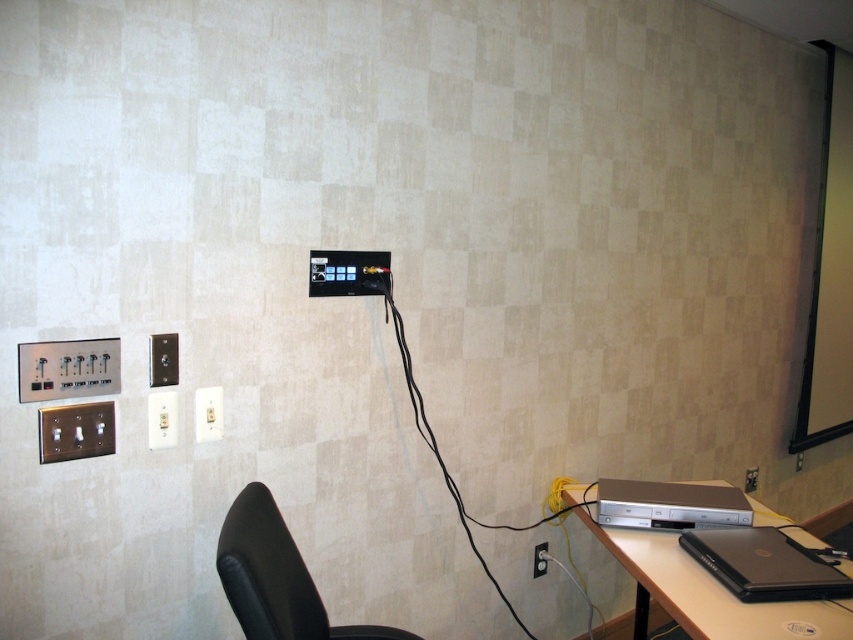
Question: Which point appears farthest from the camera in this image?

Choices:
 (A) (753, 481)
 (B) (694, 528)
 (C) (822, 532)

Answer: (C)

Question: Considering the relative positions of white plastic light switch at center and black plastic electrical outlet at center in the image provided, where is white plastic light switch at center located with respect to black plastic electrical outlet at center?

Choices:
 (A) right
 (B) left

Answer: (B)

Question: Which point is farther to the camera?

Choices:
 (A) white plastic light switch at lower left
 (B) silver metallic dvd player at lower right

Answer: (B)

Question: Does silver metallic dvd player at lower right have a smaller size compared to black plastic electrical outlet at lower right?

Choices:
 (A) no
 (B) yes

Answer: (A)

Question: Which is farther from the black plastic electrical outlet at lower right?

Choices:
 (A) silver metallic dvd player at lower right
 (B) black fabric swivel chair at lower left
 (C) silver metallic computer desk at lower right

Answer: (B)

Question: Does silver metallic computer desk at lower right come in front of black matte laptop at lower right?

Choices:
 (A) no
 (B) yes

Answer: (B)